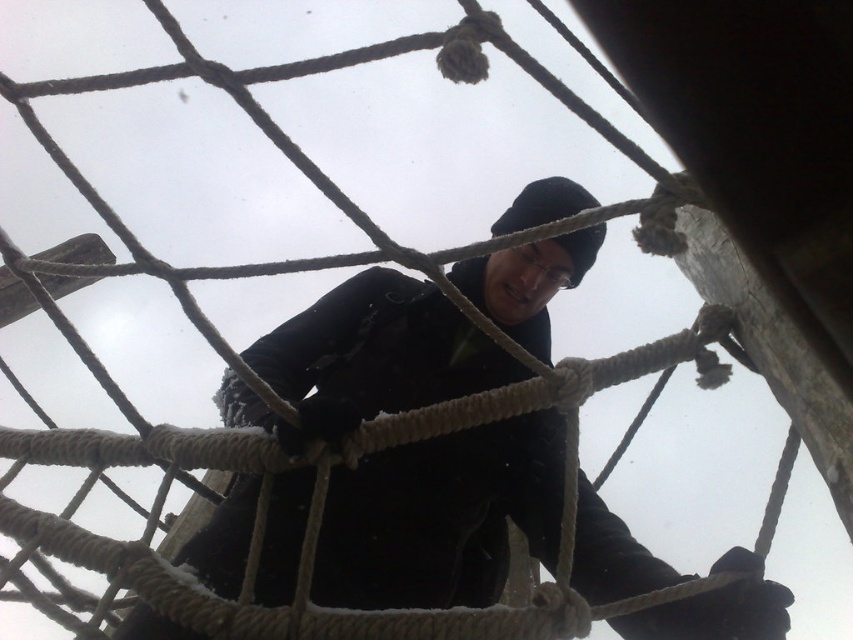
Does black matte jacket at center appear under black woolen hat at upper center?

Yes.

What do you see at coordinates (440, 516) in the screenshot?
I see `black matte jacket at center` at bounding box center [440, 516].

Locate an element on the screen. black matte jacket at center is located at coordinates (440, 516).